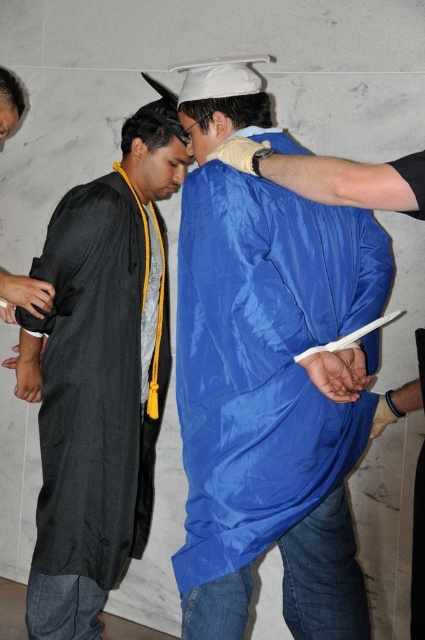
You are standing at the point labeled as point (269, 376) in the graduation scene. What type of clothing material is directly beneath your feet?

The point (269, 376) is on the blue fabric graduation gown at center, so the clothing material beneath your feet is blue fabric.

You are a photographer at a graduation ceremony. You need to capture a photo of both the blue fabric graduation gown at center and the matte black graduation gown at left. Which gown has a narrower silhouette?

The blue fabric graduation gown at center is thinner than the matte black graduation gown at left, so it has a narrower silhouette.